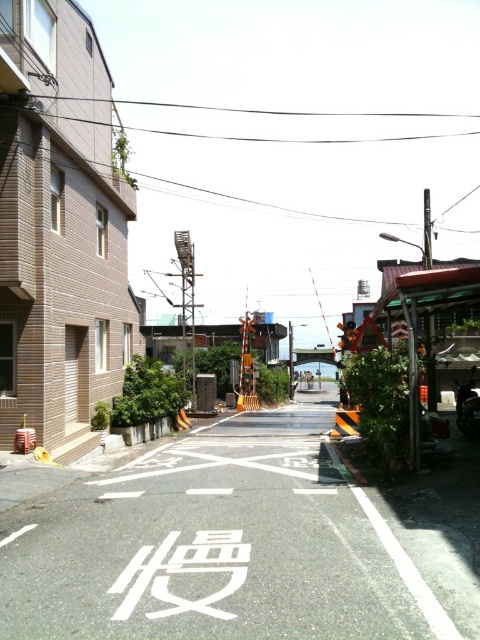
You are a cyclist approaching the intersection shown in the image. You see a white asphalt bike lane at center located at point (239,540). Where should you position yourself to stay within the bike lane?

You should position yourself at the point (239,540) where the white asphalt bike lane at center is located to stay within the bike lane.

You are a delivery rider on a motorcycle that is 2 meters long. You are approaching the intersection and need to pass through the white asphalt bike lane at center and the black plastic traffic light at center. Can your motorcycle fit between them without going over the bike lane or hitting the traffic light?

The white asphalt bike lane at center is 7.93 meters from the black plastic traffic light at center. Since your motorcycle is 2 meters long, it can easily fit between them without any issues.

From the picture: You are a cyclist approaching the intersection and see the white asphalt bike lane at center and the black plastic traffic light at center. Which object is positioned higher from the ground?

The black plastic traffic light at center is positioned higher from the ground than the white asphalt bike lane at center.